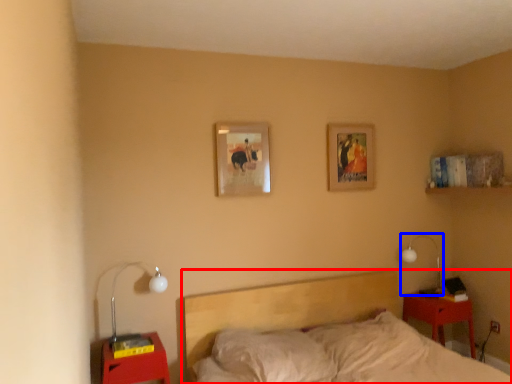
Question: Which object is closer to the camera taking this photo, bed (highlighted by a red box) or lamp (highlighted by a blue box)?

Choices:
 (A) bed
 (B) lamp

Answer: (A)